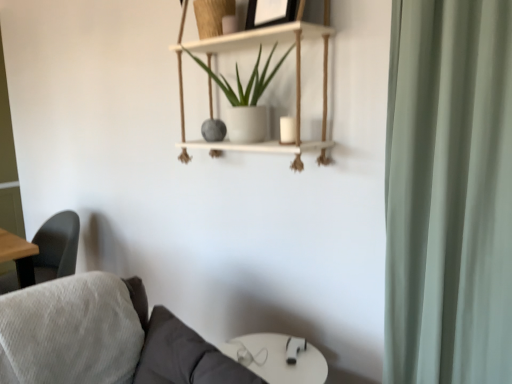
Question: Can you confirm if wooden picture frame at upper center is positioned to the left of white matte pot at upper center?

Choices:
 (A) no
 (B) yes

Answer: (A)

Question: Is wooden picture frame at upper center turned away from white matte pot at upper center?

Choices:
 (A) yes
 (B) no

Answer: (B)

Question: Does wooden picture frame at upper center turn towards white matte pot at upper center?

Choices:
 (A) no
 (B) yes

Answer: (A)

Question: Can we say wooden picture frame at upper center lies outside white matte pot at upper center?

Choices:
 (A) yes
 (B) no

Answer: (A)

Question: From a real-world perspective, is wooden picture frame at upper center located beneath white matte pot at upper center?

Choices:
 (A) no
 (B) yes

Answer: (A)

Question: Choose the correct answer: Is white matte pot at upper center inside wooden picture frame at upper center or outside it?

Choices:
 (A) inside
 (B) outside

Answer: (B)

Question: Is point (234, 66) positioned closer to the camera than point (246, 24)?

Choices:
 (A) closer
 (B) farther

Answer: (B)

Question: Looking at the image, does white matte pot at upper center seem bigger or smaller compared to wooden picture frame at upper center?

Choices:
 (A) big
 (B) small

Answer: (A)

Question: From a real-world perspective, is white matte pot at upper center physically located above or below wooden picture frame at upper center?

Choices:
 (A) below
 (B) above

Answer: (A)

Question: Looking at their shapes, would you say white wood shelf at upper center is wider or thinner than textured gray fabric couch at lower left?

Choices:
 (A) wide
 (B) thin

Answer: (B)

Question: Is point (182, 6) closer or farther from the camera than point (153, 311)?

Choices:
 (A) closer
 (B) farther

Answer: (B)

Question: Is white wood shelf at upper center situated inside textured gray fabric couch at lower left or outside?

Choices:
 (A) inside
 (B) outside

Answer: (B)

Question: Considering the positions of white wood shelf at upper center and textured gray fabric couch at lower left in the image, is white wood shelf at upper center taller or shorter than textured gray fabric couch at lower left?

Choices:
 (A) tall
 (B) short

Answer: (A)

Question: Does point (181, 326) appear closer or farther from the camera than point (315, 145)?

Choices:
 (A) closer
 (B) farther

Answer: (A)

Question: From their relative heights in the image, would you say textured gray fabric couch at lower left is taller or shorter than white wood shelf at upper center?

Choices:
 (A) tall
 (B) short

Answer: (B)